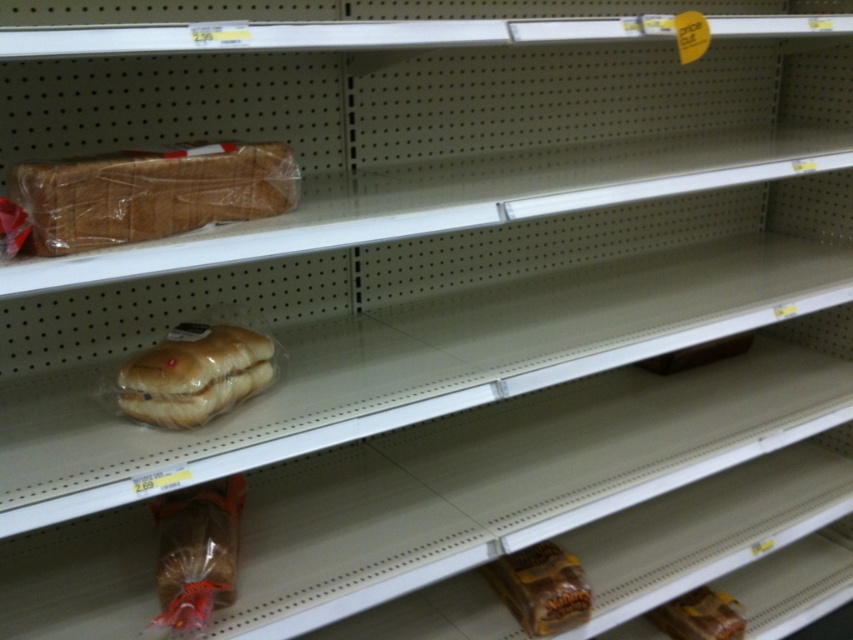
Looking at this image, does translucent plastic loaf of bread at upper left appear on the right side of brown paper bag at lower right?

In fact, translucent plastic loaf of bread at upper left is to the left of brown paper bag at lower right.

You are a GUI agent. You are given a task and a screenshot of the screen. Output one action in this format:
    pyautogui.click(x=<x>, y=<y>)
    Task: Click on the translucent plastic loaf of bread at upper left
    
    Given the screenshot: What is the action you would take?
    pyautogui.click(x=149, y=193)

Who is more distant from viewer, [117,193] or [548,614]?

The point [548,614] is behind.

Identify the location of translucent plastic loaf of bread at upper left. (149, 193).

Is point (175, 212) positioned before point (253, 358)?

Yes, point (175, 212) is in front of point (253, 358).

How far apart are translucent plastic loaf of bread at upper left and golden matte bread at center?

A distance of 8.64 inches exists between translucent plastic loaf of bread at upper left and golden matte bread at center.

Who is more forward, (172, 196) or (239, 346)?

Positioned in front is point (172, 196).

Locate an element on the screen. translucent plastic loaf of bread at upper left is located at coordinates (149, 193).

Does point (561, 628) come closer to viewer compared to point (683, 634)?

Yes, point (561, 628) is closer to viewer.

Between brown paper bag at lower right and brown matte bread at lower right, which one has more height?

brown paper bag at lower right

Is point (498, 563) farther from viewer compared to point (692, 628)?

No.

Identify the location of brown paper bag at lower right. The image size is (853, 640). (541, 588).